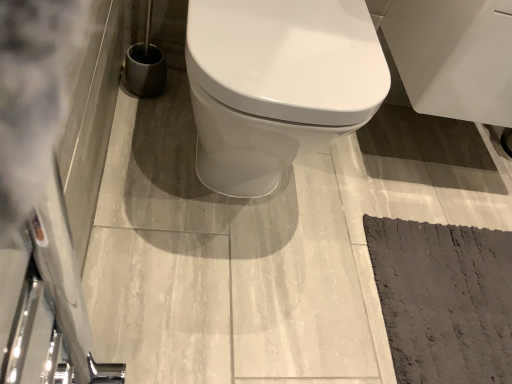
The height and width of the screenshot is (384, 512). I want to click on free region under white glossy cabinet at upper right (from a real-world perspective), so click(x=414, y=147).